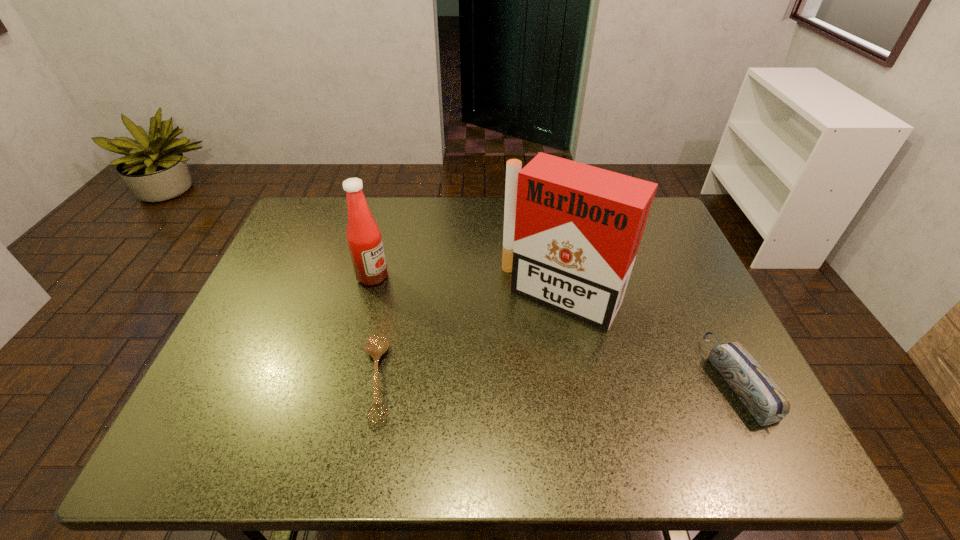
The height and width of the screenshot is (540, 960). I want to click on blank region between the pencil box and the third shortest object, so click(555, 328).

This screenshot has width=960, height=540. What are the coordinates of `blank region between the third tallest object and the shortest object` in the screenshot? It's located at pos(558,380).

Identify which object is the second closest to the condiment. Please provide its 2D coordinates. Your answer should be formatted as a tuple, i.e. [(x, y)], where the tuple contains the x and y coordinates of a point satisfying the conditions above.

[(572, 231)]

Locate which object ranks third in proximity to the pencil box. Please provide its 2D coordinates. Your answer should be formatted as a tuple, i.e. [(x, y)], where the tuple contains the x and y coordinates of a point satisfying the conditions above.

[(364, 238)]